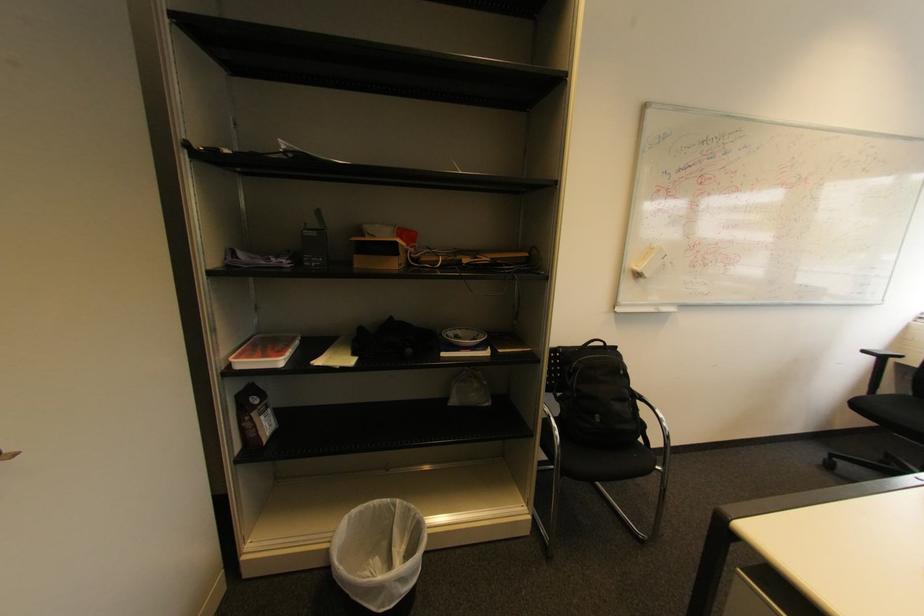
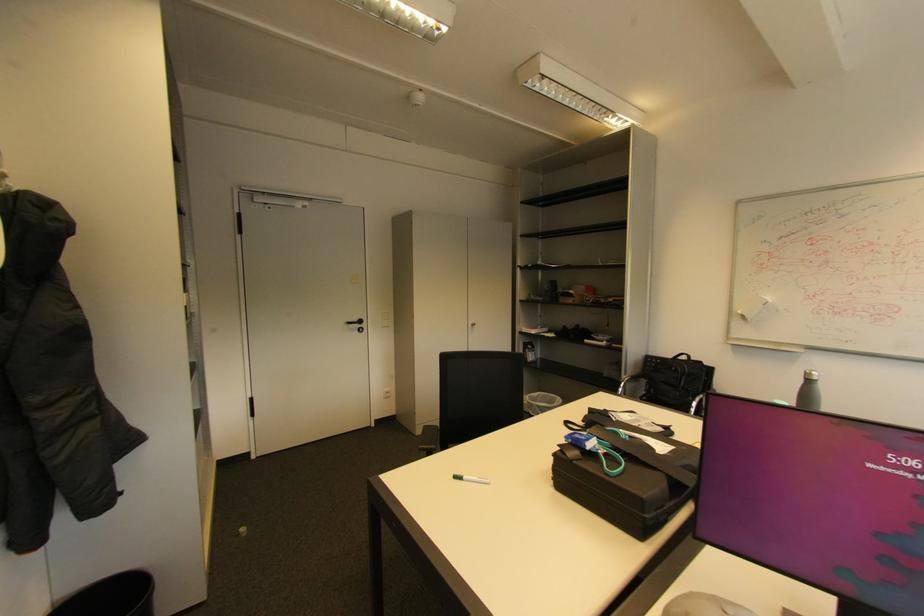
The point at (626, 373) is marked in the first image. Where is the corresponding point in the second image?

(678, 369)